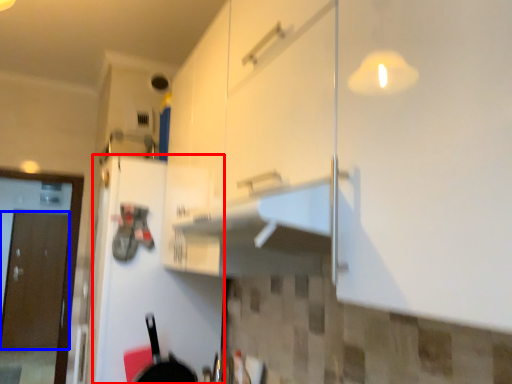
Question: Which object is closer to the camera taking this photo, door (highlighted by a red box) or door (highlighted by a blue box)?

Choices:
 (A) door
 (B) door

Answer: (A)